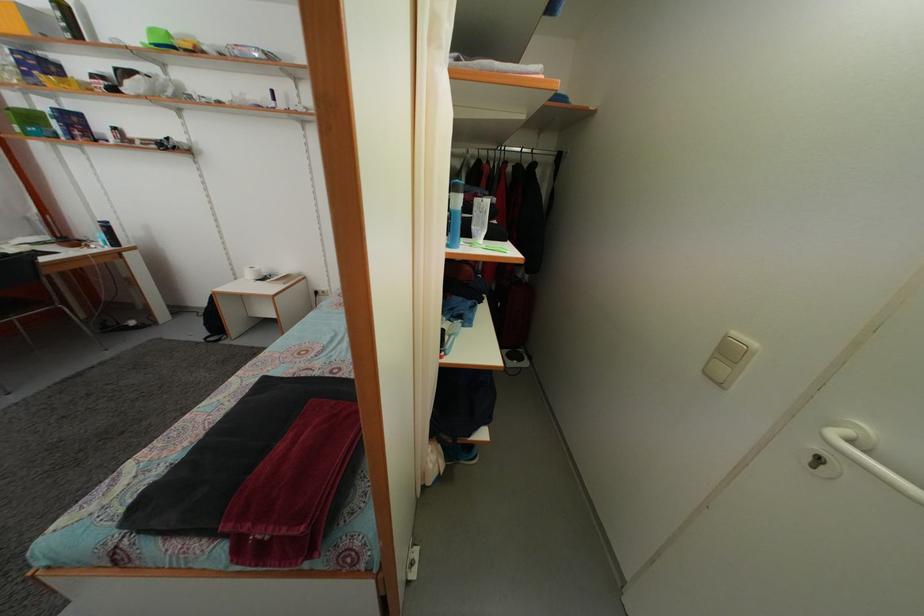
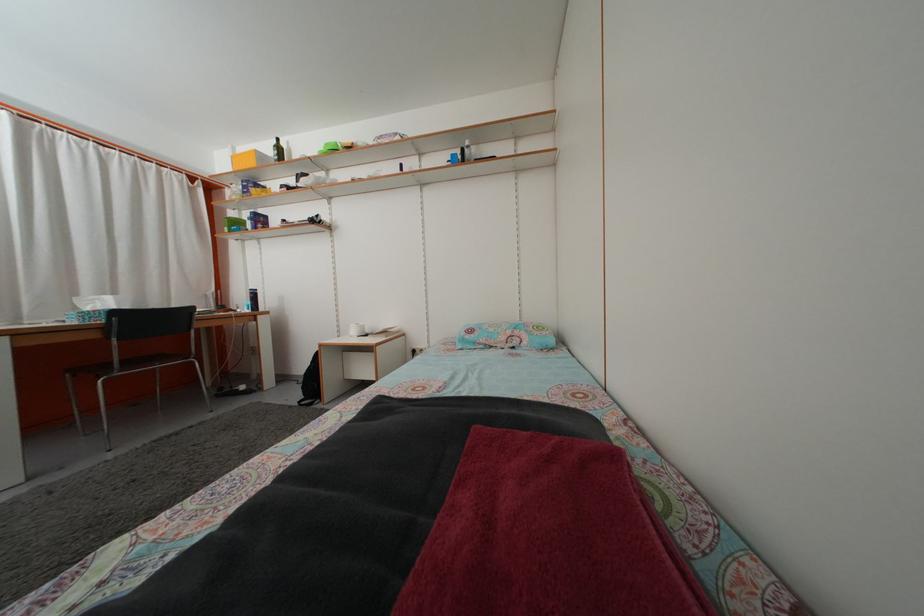
Find the pixel in the second image that matches point (213, 342) in the first image.

(309, 405)